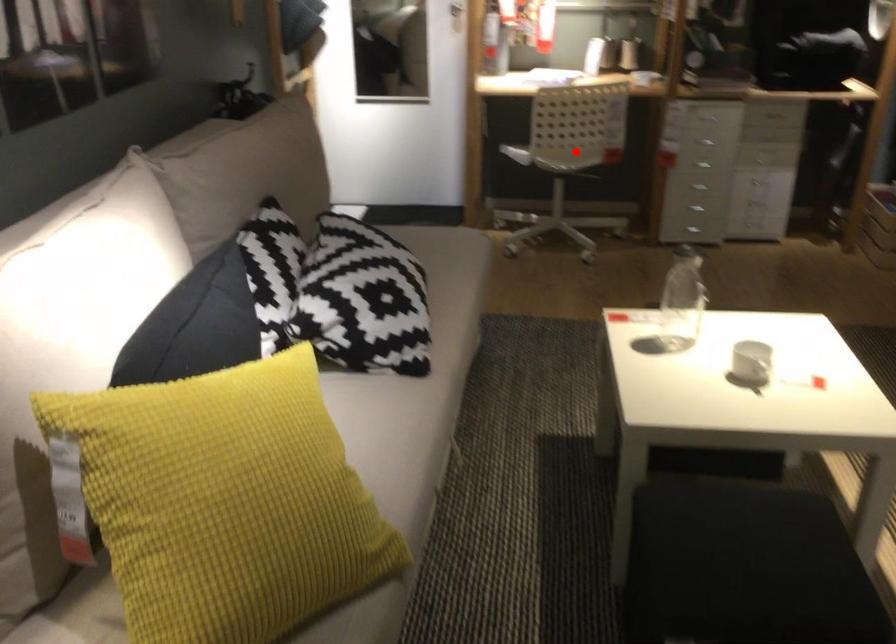
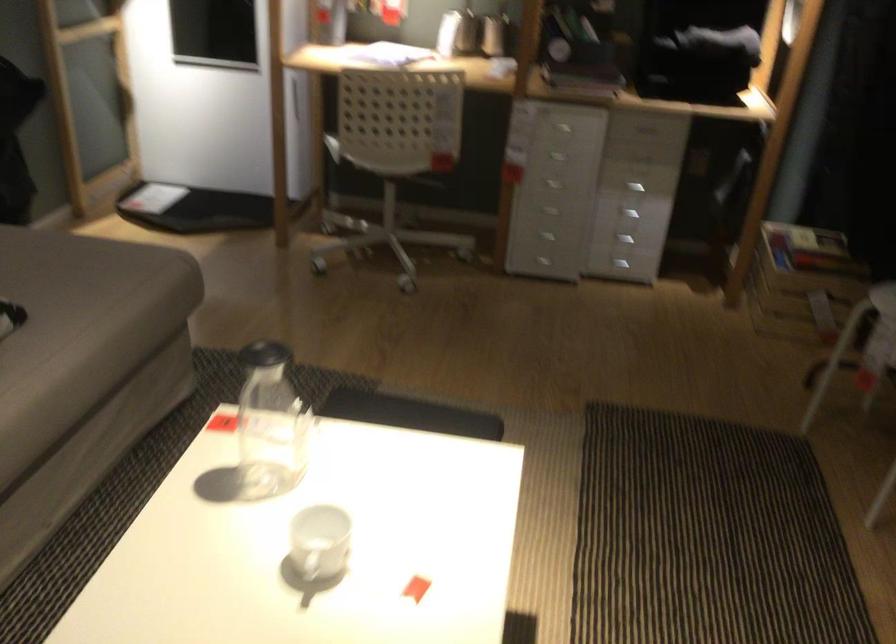
Question: I am providing you with two images of the same scene from different viewpoints. Image1 has a red point marked. In image2, the corresponding 3D location appears at what relative position? Reply with the corresponding letter.

Choices:
 (A) Closer
 (B) Farther

Answer: (A)